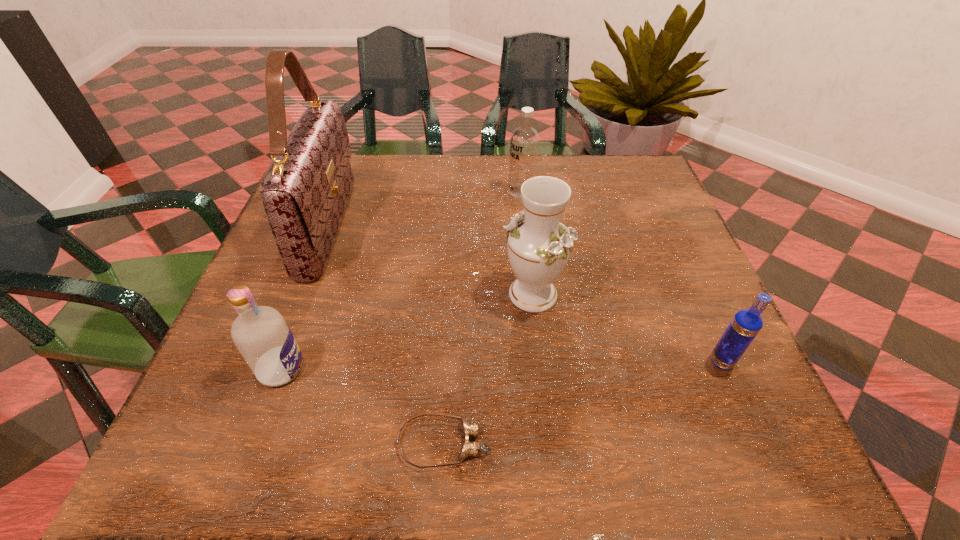
Image resolution: width=960 pixels, height=540 pixels. In order to click on free point between the farthest vodka and the leftmost vodka in this screenshot , I will do `click(401, 280)`.

Where is `vacant area that lies between the second vodka from right to left and the leftmost vodka`? vacant area that lies between the second vodka from right to left and the leftmost vodka is located at coordinates click(x=401, y=280).

This screenshot has height=540, width=960. I want to click on vacant point located between the second vodka from left to right and the tallest object, so click(424, 209).

Find the location of a particular element. vacant area between the leftmost vodka and the shortest vodka is located at coordinates (501, 365).

Locate an element on the screen. This screenshot has height=540, width=960. free area in between the leftmost vodka and the rightmost object is located at coordinates (501, 365).

Image resolution: width=960 pixels, height=540 pixels. What are the coordinates of `free space between the handbag and the second vodka from right to left` in the screenshot? It's located at (424, 209).

You are a GUI agent. You are given a task and a screenshot of the screen. Output one action in this format:
    pyautogui.click(x=<x>, y=<y>)
    Task: Click on the unoccupied area between the third object from left to right and the leftmost vodka
    Image resolution: width=960 pixels, height=540 pixels.
    Given the screenshot: What is the action you would take?
    pos(362,406)

The width and height of the screenshot is (960, 540). What are the coordinates of `blank region between the handbag and the leftmost vodka` in the screenshot? It's located at point(305,298).

Locate an element on the screen. This screenshot has width=960, height=540. free point between the third object from left to right and the tallest object is located at coordinates (386, 335).

This screenshot has width=960, height=540. I want to click on empty location between the shortest object and the leftmost vodka, so click(x=362, y=406).